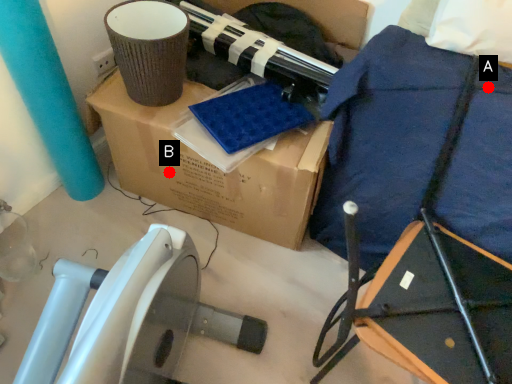
Question: Two points are circled on the image, labeled by A and B beside each circle. Which point is closer to the camera?

Choices:
 (A) A is closer
 (B) B is closer

Answer: (A)